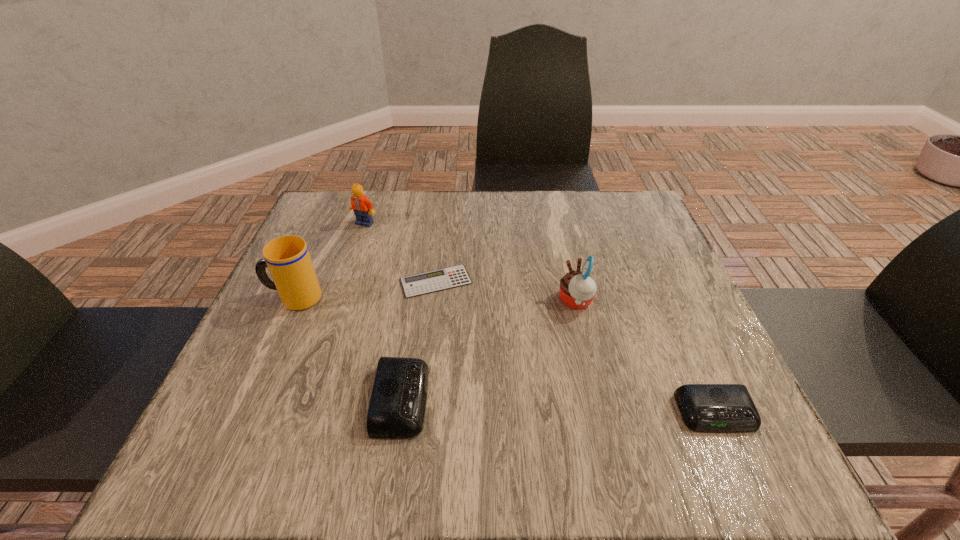
Image resolution: width=960 pixels, height=540 pixels. I want to click on vacant area between the leftmost object and the left alarm clock, so click(348, 349).

Find the location of `free space between the second shortest object and the taller alarm clock`. free space between the second shortest object and the taller alarm clock is located at coordinates (559, 406).

Find the location of a particular element. vacant space that is in between the cup and the taller alarm clock is located at coordinates (348, 349).

At what (x,y) coordinates should I click in order to perform the action: click on vacant space in between the second object from left to right and the shortest object. Please return your answer as a coordinate pair (x, y). The height and width of the screenshot is (540, 960). Looking at the image, I should click on (400, 252).

Where is `free space between the fifth tallest object and the tallest object`? The image size is (960, 540). free space between the fifth tallest object and the tallest object is located at coordinates (505, 355).

Where is `vacant region between the muffin and the calculator`? vacant region between the muffin and the calculator is located at coordinates (506, 292).

In order to click on vacant space in between the fifth tallest object and the muffin in this screenshot , I will do `click(646, 357)`.

Choose which object is the fourth nearest neighbor to the cup. Please provide its 2D coordinates. Your answer should be formatted as a tuple, i.e. [(x, y)], where the tuple contains the x and y coordinates of a point satisfying the conditions above.

[(577, 288)]

Where is `the closest object to the right alarm clock`? The width and height of the screenshot is (960, 540). the closest object to the right alarm clock is located at coordinates (577, 288).

The image size is (960, 540). What are the coordinates of `free space that satisfies the following two spatial constraints: 1. on the front-facing side of the calculator; 2. on the left side of the Lego` in the screenshot? It's located at (346, 281).